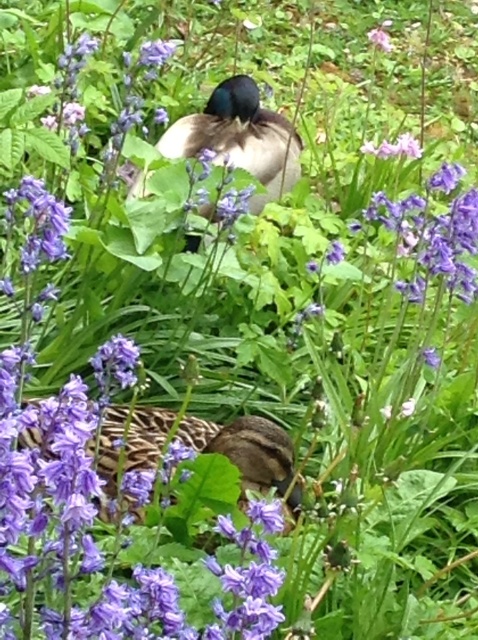
Question: Is shiny black duck at center smaller than pink matte flower at upper center?

Choices:
 (A) no
 (B) yes

Answer: (A)

Question: Which point is farther from the camera taking this photo?

Choices:
 (A) (276, 113)
 (B) (380, 49)

Answer: (B)

Question: Is shiny black duck at center above pink matte flower at upper center?

Choices:
 (A) yes
 (B) no

Answer: (B)

Question: Can you confirm if shiny black duck at center is smaller than pink matte flower at upper center?

Choices:
 (A) no
 (B) yes

Answer: (A)